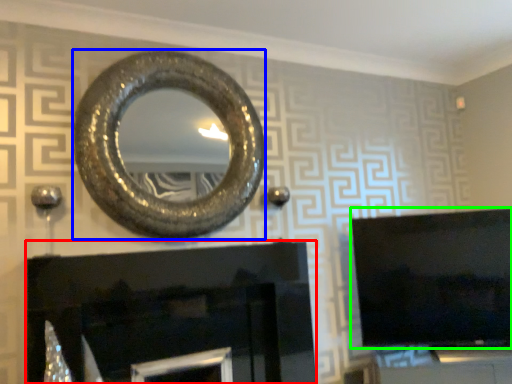
Question: Based on their relative distances, which object is farther from fireplace (highlighted by a red box)? Choose from oval (highlighted by a blue box) and television (highlighted by a green box).

Choices:
 (A) oval
 (B) television

Answer: (B)